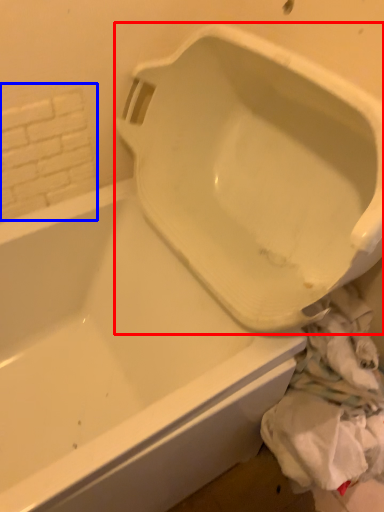
Question: Which point is further to the camera, urinal (highlighted by a red box) or tile (highlighted by a blue box)?

Choices:
 (A) urinal
 (B) tile

Answer: (B)